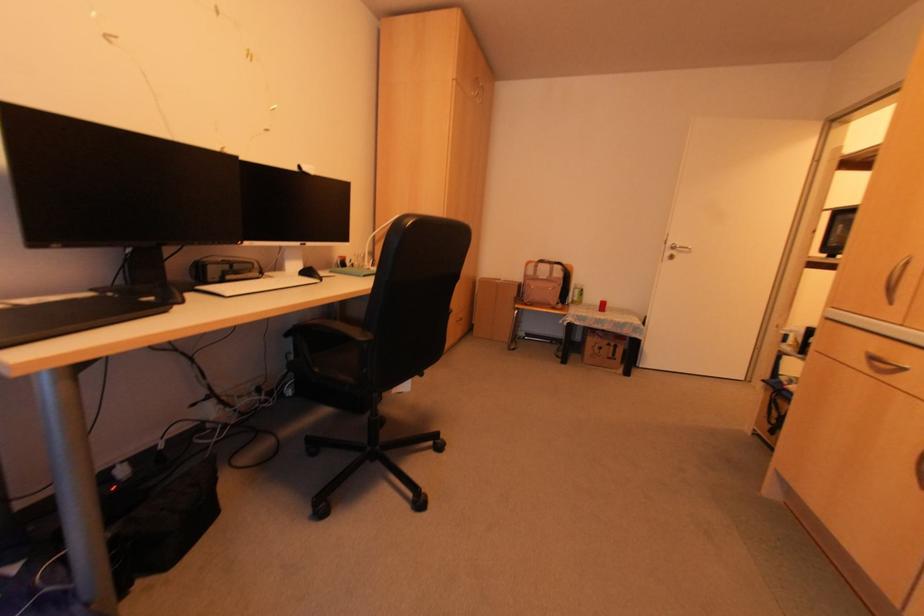
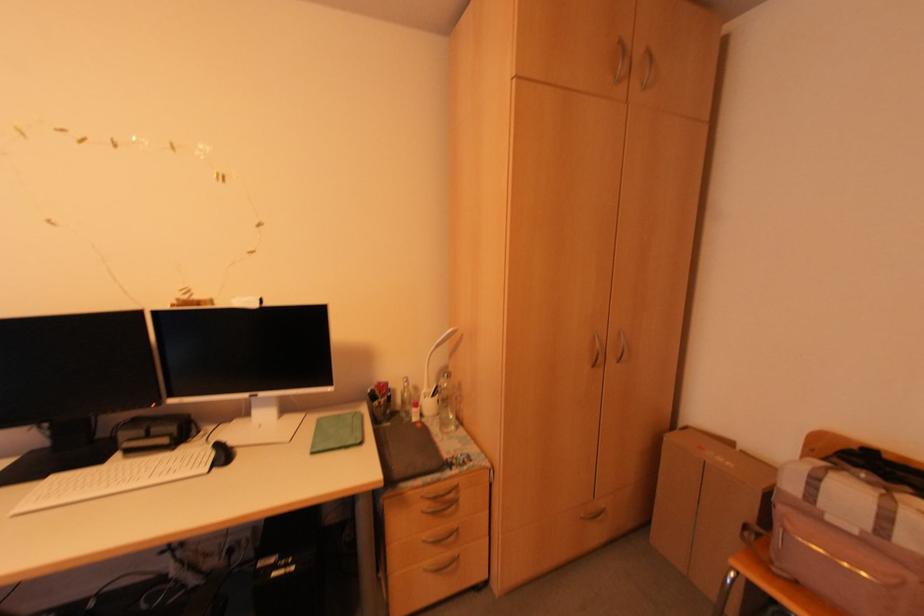
Find the pixel in the second image that matches pixel 458 317 in the first image.

(602, 506)